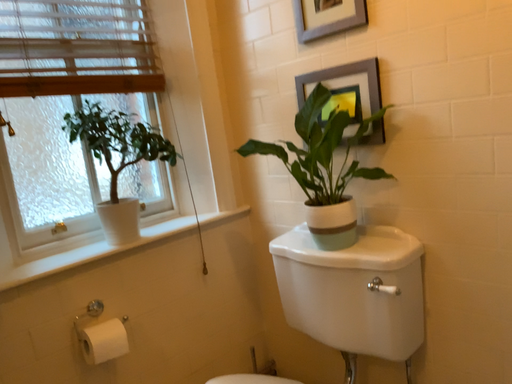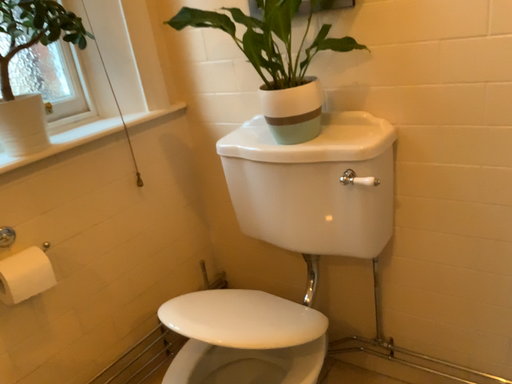
Question: Which way did the camera rotate in the video?

Choices:
 (A) rotated right
 (B) rotated left

Answer: (A)